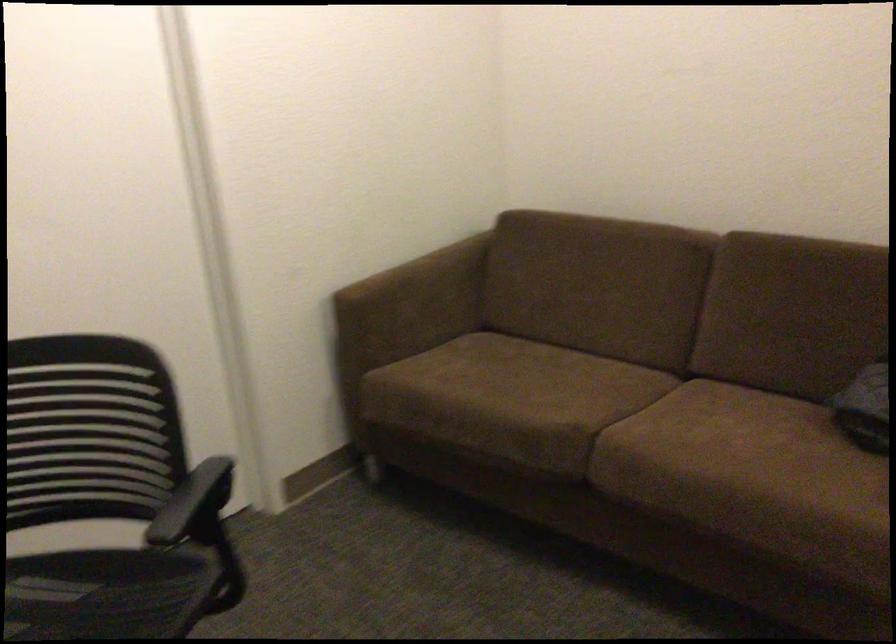
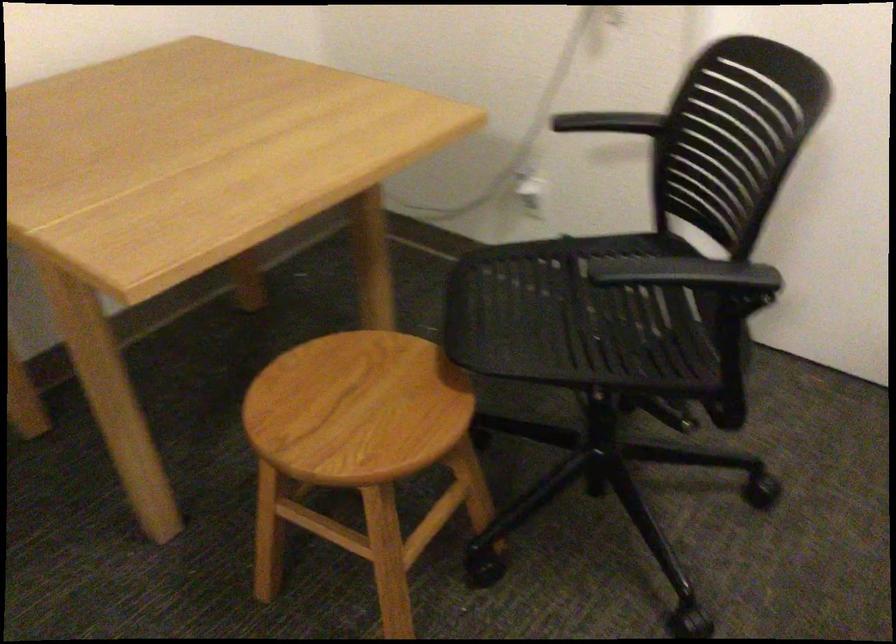
The point at (169, 512) is marked in the first image. Where is the corresponding point in the second image?

(685, 272)